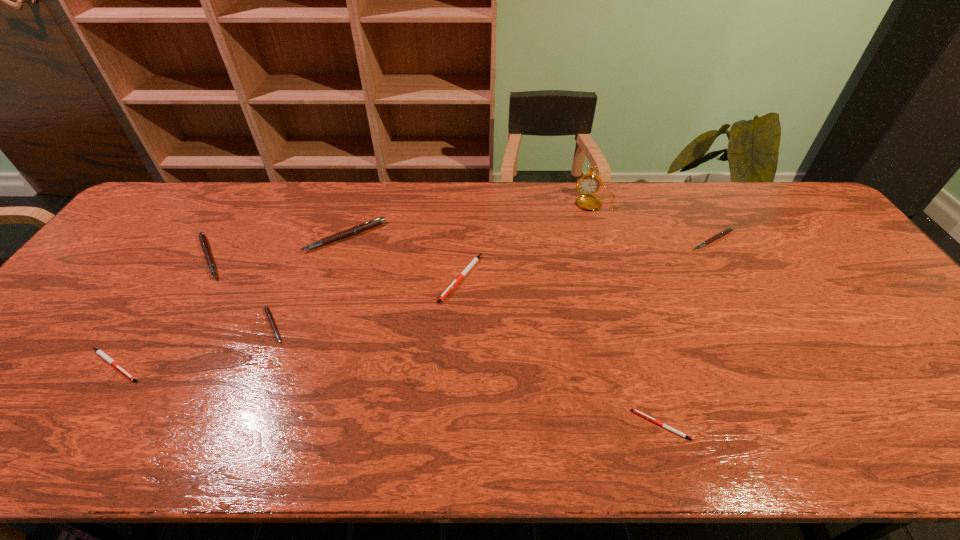
Where is `free space located on the clicker of the farthest white pen`? This screenshot has width=960, height=540. free space located on the clicker of the farthest white pen is located at coordinates (459, 325).

Locate an element on the screen. The width and height of the screenshot is (960, 540). free space located 0.370m at the nib of the third nearest pen is located at coordinates (434, 325).

At what (x,y) coordinates should I click in order to perform the action: click on vacant space positioned 0.160m on the clicker of the second smallest white pen. Please return your answer as a coordinate pair (x, y). Looking at the image, I should click on (216, 365).

This screenshot has height=540, width=960. I want to click on vacant region located 0.190m on the clicker of the shortest object, so click(x=544, y=426).

This screenshot has height=540, width=960. I want to click on vacant space located 0.330m on the clicker of the shortest object, so click(x=478, y=426).

You are a GUI agent. You are given a task and a screenshot of the screen. Output one action in this format:
    pyautogui.click(x=<x>, y=<y>)
    Task: Click on the free space located 0.150m on the clicker of the shortest object
    
    Given the screenshot: What is the action you would take?
    pyautogui.click(x=563, y=426)

The image size is (960, 540). Identify the location of pocket watch positioned at the far edge. (587, 184).

Where is `pen located at the far edge`? The image size is (960, 540). pen located at the far edge is located at coordinates (367, 225).

Identify the location of object at the near edge. pyautogui.click(x=637, y=412).

Find the location of `vacant space at the far edge of the desktop`. vacant space at the far edge of the desktop is located at coordinates (396, 195).